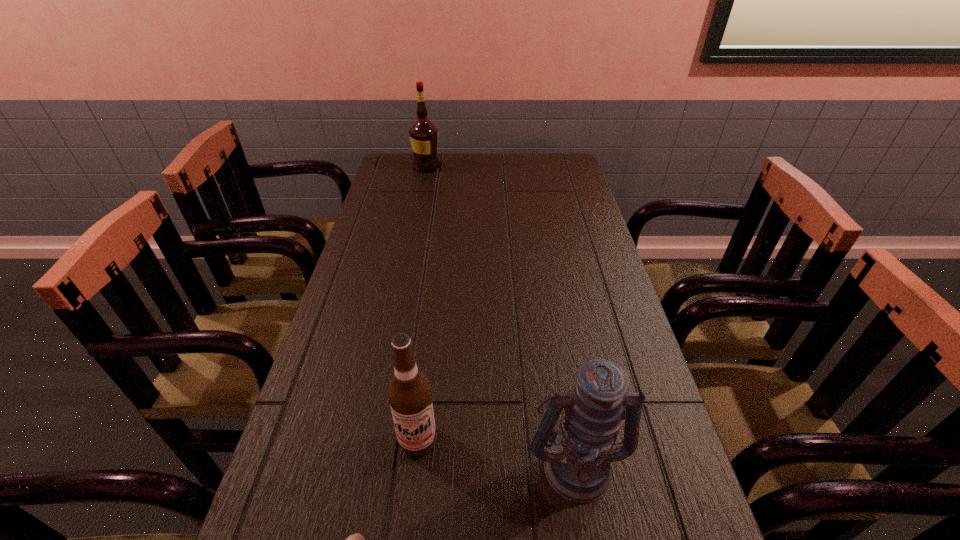
This screenshot has height=540, width=960. I want to click on the farthest object, so click(423, 134).

Locate an element on the screen. The width and height of the screenshot is (960, 540). the nearer alcohol is located at coordinates (409, 393).

Where is `lantern`? lantern is located at coordinates (577, 465).

I want to click on vacant region located 0.170m on the label of the farther alcohol, so click(x=484, y=166).

What are the coordinates of `vacant space located 0.060m on the label of the nearer alcohol` in the screenshot? It's located at (412, 492).

Where is `object that is positioned at the far edge`? Image resolution: width=960 pixels, height=540 pixels. object that is positioned at the far edge is located at coordinates (423, 134).

The height and width of the screenshot is (540, 960). I want to click on object located in the left edge section of the desktop, so click(423, 134).

I want to click on object that is positioned at the right edge, so click(577, 465).

The image size is (960, 540). I want to click on object that is at the far left corner, so click(423, 134).

Where is `free region at the far edge`? free region at the far edge is located at coordinates (529, 154).